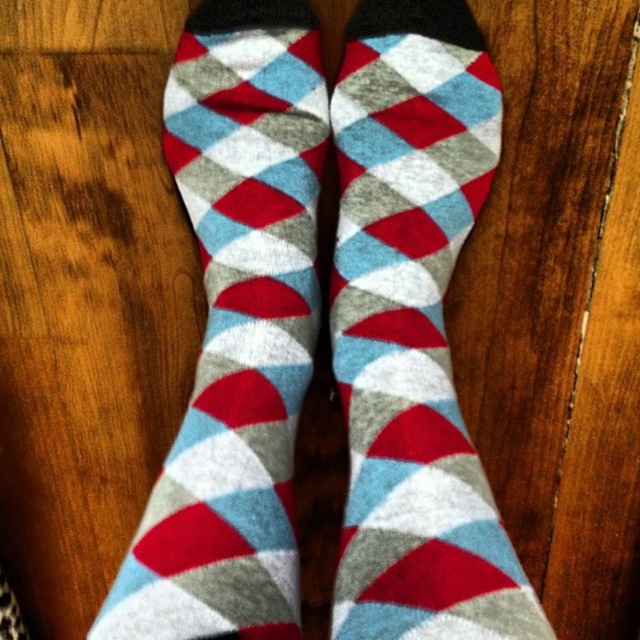
This screenshot has height=640, width=640. Identify the location of argyle wool socks at center. (413, 332).